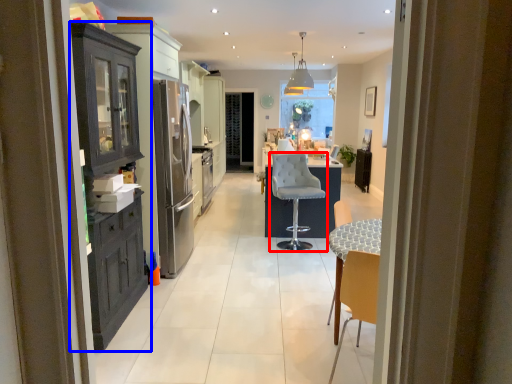
Question: Among these objects, which one is farthest to the camera, chair (highlighted by a red box) or cabinetry (highlighted by a blue box)?

Choices:
 (A) chair
 (B) cabinetry

Answer: (A)